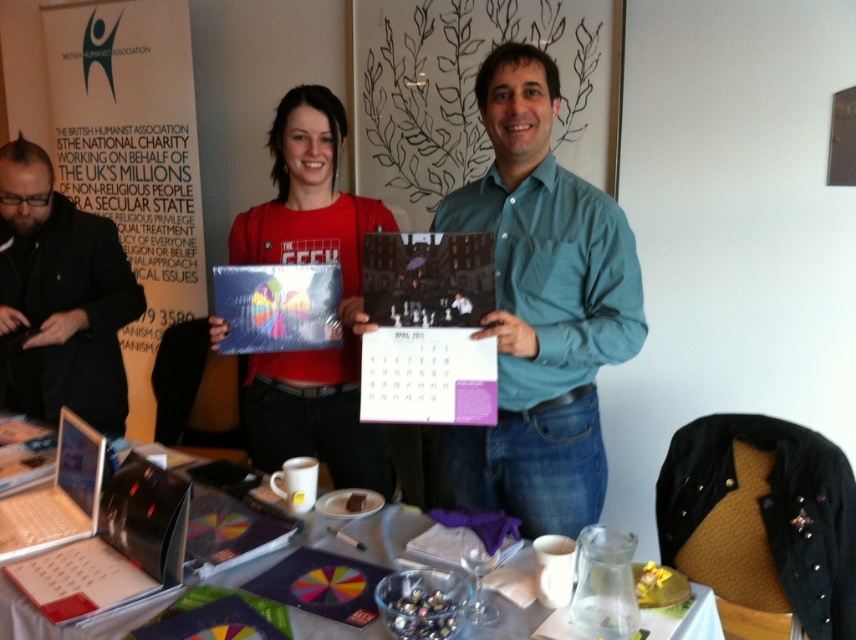
Question: Which of the following is the farthest from the observer?

Choices:
 (A) silver metallic laptop at lower left
 (B) silver plastic laptop at lower left

Answer: (B)

Question: Which of the following is the closest to the observer?

Choices:
 (A) metallic glossy calendar at center
 (B) silver metallic laptop at lower left

Answer: (B)

Question: Is silver metallic laptop at lower left smaller than translucent plastic table at center?

Choices:
 (A) no
 (B) yes

Answer: (B)

Question: Is silver metallic laptop at lower left to the right of metallic glossy calendar at center from the viewer's perspective?

Choices:
 (A) yes
 (B) no

Answer: (B)

Question: Which object is farther from the camera taking this photo?

Choices:
 (A) metallic glossy calendar at center
 (B) matte red shirt at center

Answer: (A)

Question: Does matte paper calendar at center have a smaller size compared to silver plastic laptop at lower left?

Choices:
 (A) no
 (B) yes

Answer: (B)